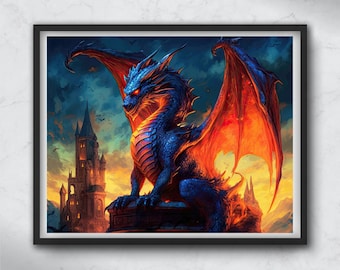
Identify the location of frame. Image resolution: width=340 pixels, height=270 pixels. (29, 239).